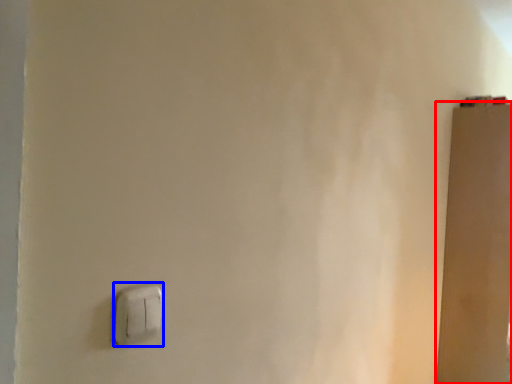
Question: Which object is further to the camera taking this photo, door (highlighted by a red box) or light switch (highlighted by a blue box)?

Choices:
 (A) door
 (B) light switch

Answer: (A)